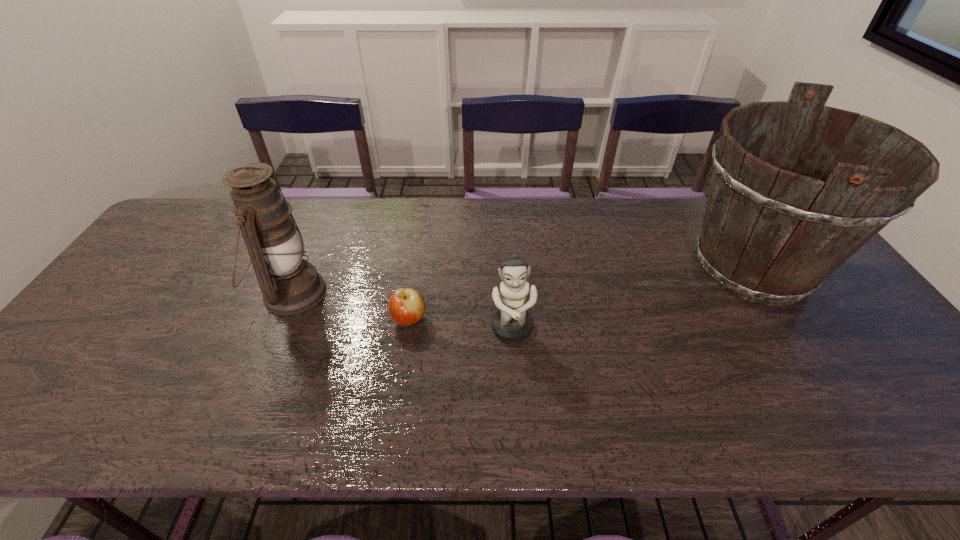
Where is `bucket`? The image size is (960, 540). bucket is located at coordinates (776, 225).

Find the location of a particular element. This screenshot has width=960, height=540. the second tallest object is located at coordinates (289, 284).

Find the location of a particular element. The height and width of the screenshot is (540, 960). oil lamp is located at coordinates (289, 284).

Locate an element on the screen. This screenshot has width=960, height=540. the second object from right to left is located at coordinates pyautogui.click(x=512, y=323).

Locate an element on the screen. Image resolution: width=960 pixels, height=540 pixels. figurine is located at coordinates pos(512,323).

The height and width of the screenshot is (540, 960). I want to click on the shortest object, so click(x=406, y=306).

Locate an element on the screen. This screenshot has height=540, width=960. apple is located at coordinates (406, 306).

At what (x,y) coordinates should I click in order to perform the action: click on free space located on the left of the rightmost object. Please return your answer as a coordinate pair (x, y). Looking at the image, I should click on (540, 267).

The width and height of the screenshot is (960, 540). Find the location of `vacant space located on the right of the leftmost object`. vacant space located on the right of the leftmost object is located at coordinates (410, 293).

Locate an element on the screen. This screenshot has width=960, height=540. vacant space located 0.220m on the front-facing side of the figurine is located at coordinates (519, 435).